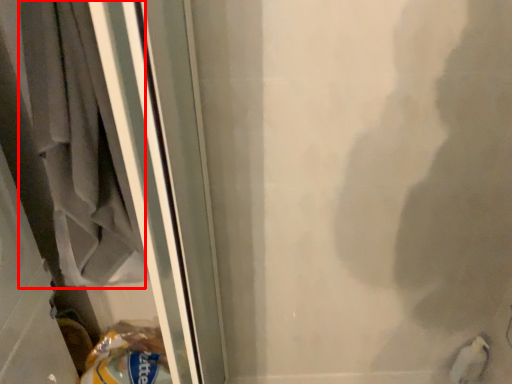
Question: From the image's perspective, where is laundry (annotated by the red box) located relative to animal?

Choices:
 (A) above
 (B) below

Answer: (A)